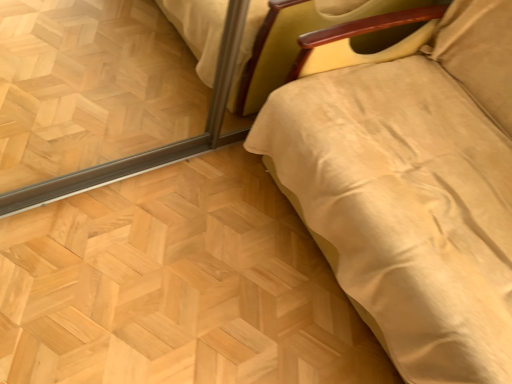
Question: Based on their positions, is natural wood floor at lower right located to the left or right of beige fabric bed at right?

Choices:
 (A) right
 (B) left

Answer: (B)

Question: From a real-world perspective, is natural wood floor at lower right above or below beige fabric bed at right?

Choices:
 (A) below
 (B) above

Answer: (A)

Question: Relative to beige fabric bed at right, is natural wood floor at lower right in front or behind?

Choices:
 (A) behind
 (B) front

Answer: (A)

Question: Is beige fabric bed at right taller or shorter than natural wood floor at lower right?

Choices:
 (A) short
 (B) tall

Answer: (B)

Question: From the image's perspective, is beige fabric bed at right located above or below natural wood floor at lower right?

Choices:
 (A) below
 (B) above

Answer: (B)

Question: Considering the positions of point (465, 261) and point (6, 301), is point (465, 261) closer or farther from the camera than point (6, 301)?

Choices:
 (A) closer
 (B) farther

Answer: (A)

Question: In the image, is beige fabric bed at right on the left side or the right side of natural wood floor at lower right?

Choices:
 (A) left
 (B) right

Answer: (B)